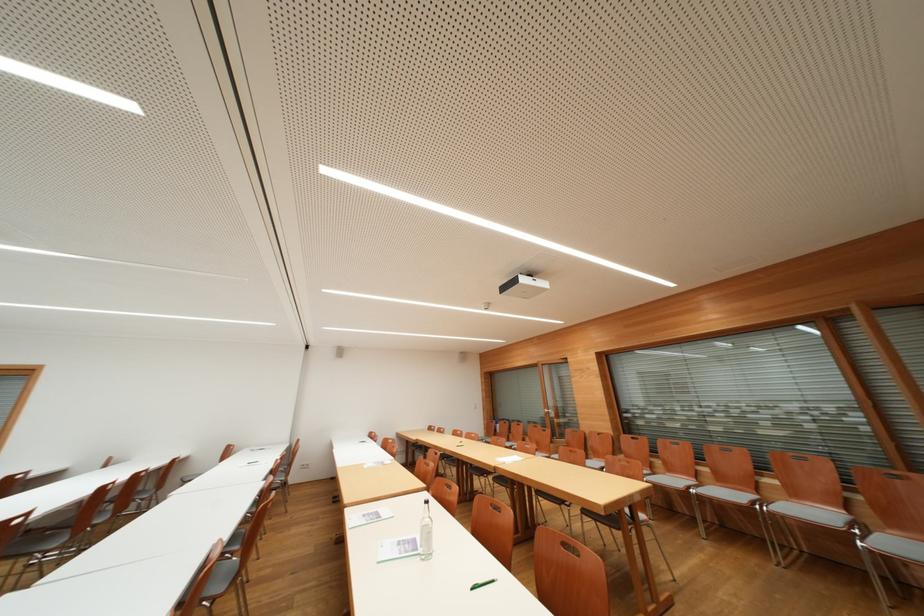
Where is `white paper booklet`? white paper booklet is located at coordinates (397, 548).